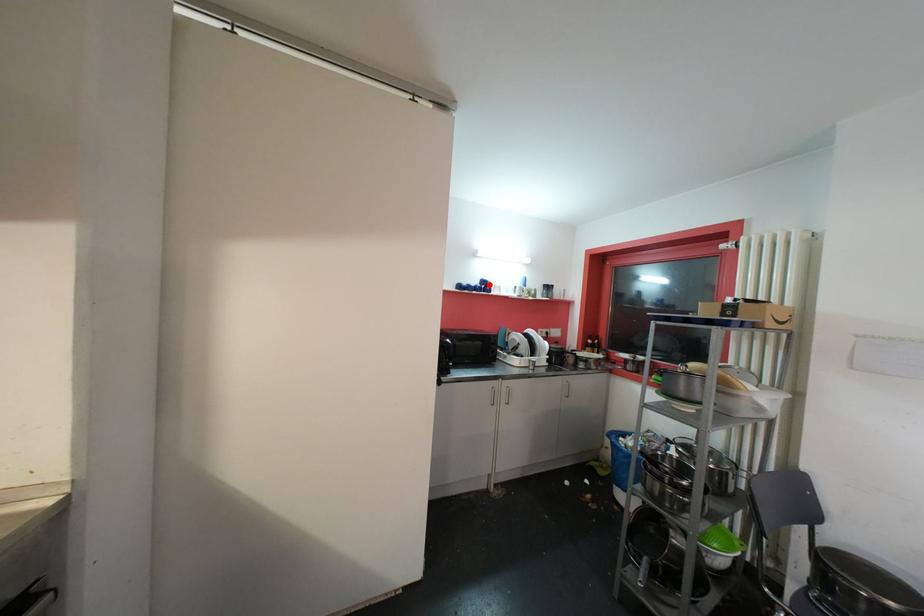
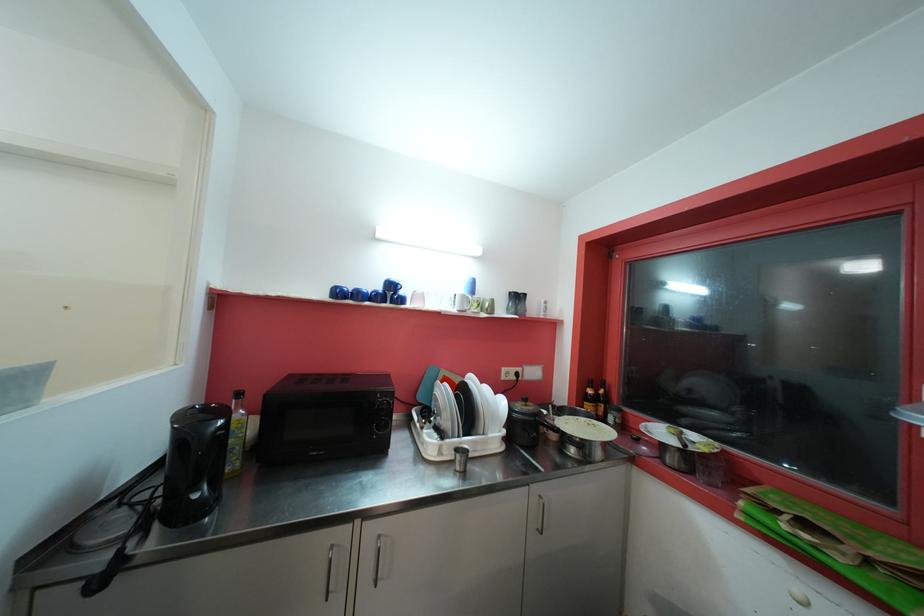
The point at the highlighted location is marked in the first image. Where is the corresponding point in the second image?

(396, 288)